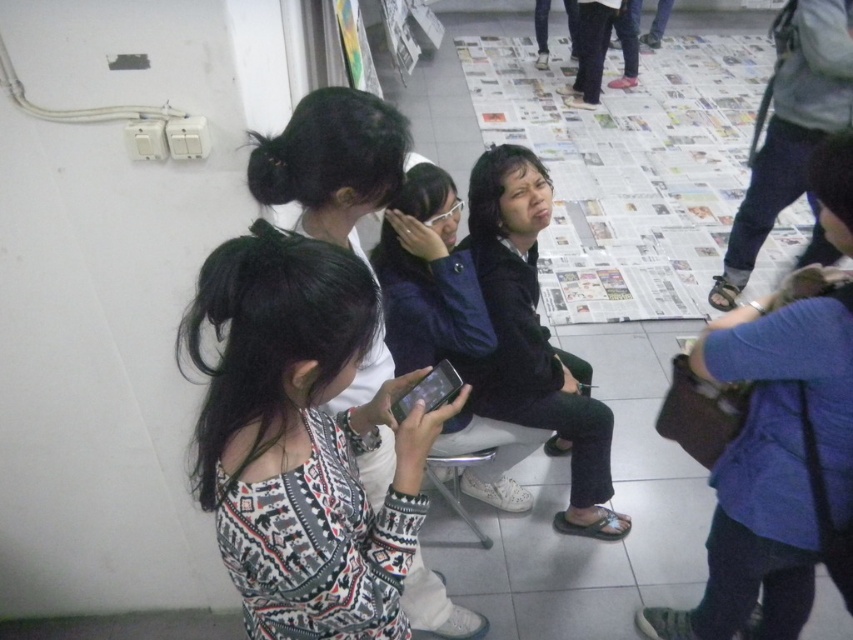
You are at a party and want to take a photo of the dark blue fabric jacket at center and the matte black phone at center. Which object is closer to the right edge of the frame?

The dark blue fabric jacket at center is positioned on the right side of the matte black phone at center, so the dark blue fabric jacket at center is closer to the right edge of the frame.

You are organizing a small event and need to place a 12 cm wide decorative item on the table between the dark blue fabric jacket at center and the matte black phone at center. Based on their widths, will there be enough space for the item if the total available space between them is 20 cm?

The dark blue fabric jacket at center might be wider than the matte black phone at center. If the jacket is wider than the phone, the total space between them could be less than 20 cm, so the 12 cm item may not fit. However, without exact measurements, it is uncertain. Please check the actual dimensions.

Based on the scene description, where is the patterned sweater at center located in terms of its 2D coordinates?

The patterned sweater at center is located at the 2D coordinates of point [332,163].